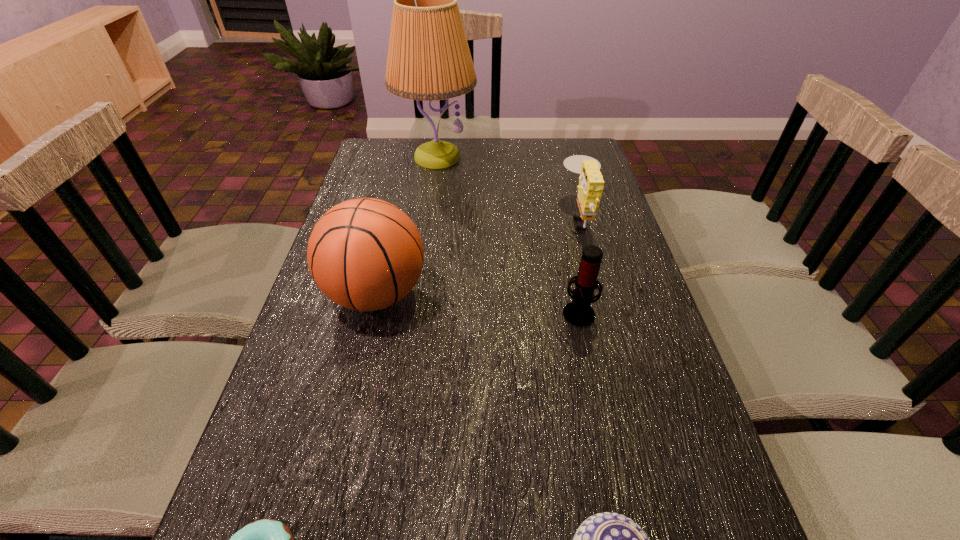
In the image, there is a desktop. Identify the location of vacant region at the far right corner. (567, 153).

The width and height of the screenshot is (960, 540). In order to click on free space between the microphone and the basketball in this screenshot , I will do point(477,303).

The image size is (960, 540). I want to click on empty space that is in between the lamp and the sponge, so click(x=509, y=186).

Where is `unoccupied area between the second tallest object and the sponge`? unoccupied area between the second tallest object and the sponge is located at coordinates (478, 255).

This screenshot has width=960, height=540. I want to click on free space between the fifth shortest object and the sponge, so click(x=478, y=255).

This screenshot has height=540, width=960. I want to click on object that stands as the second closest to the microphone, so click(365, 254).

Where is `object that stands as the closest to the microphone`? The height and width of the screenshot is (540, 960). object that stands as the closest to the microphone is located at coordinates (591, 182).

This screenshot has width=960, height=540. Find the location of `vacant position in the image that satisfies the following two spatial constraints: 1. on the side of the farthest object near the pull switch; 2. on the left side of the microphone`. vacant position in the image that satisfies the following two spatial constraints: 1. on the side of the farthest object near the pull switch; 2. on the left side of the microphone is located at coordinates (415, 312).

Identify the location of free location that satisfies the following two spatial constraints: 1. on the side of the microphone near the pull switch; 2. on the right side of the farthest object. Image resolution: width=960 pixels, height=540 pixels. (415, 312).